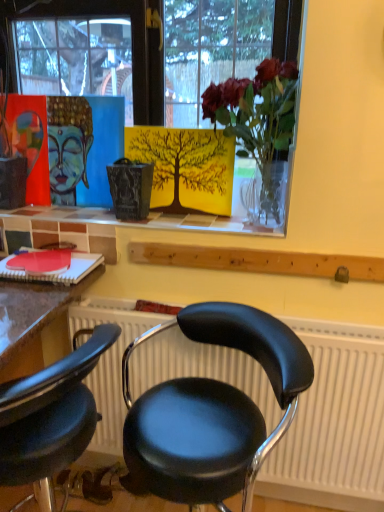
Question: Is black leather chair at lower left, marked as the 2th chair in a right-to-left arrangement, taller or shorter than translucent glass vase at upper center?

Choices:
 (A) short
 (B) tall

Answer: (B)

Question: From the image's perspective, is black leather chair at lower left, which is counted as the 1th chair, starting from the left, located above or below translucent glass vase at upper center?

Choices:
 (A) below
 (B) above

Answer: (A)

Question: Estimate the real-world distances between objects in this image. Which object is closer to the black leather chair at center, which is the first chair from right to left?

Choices:
 (A) matte acrylic painting of buddha head at upper left
 (B) black leather chair at lower left, marked as the 2th chair in a right-to-left arrangement
 (C) matte glass vase at upper center
 (D) translucent glass vase at upper center

Answer: (B)

Question: Which object is the farthest from the translucent glass vase at upper center?

Choices:
 (A) black leather chair at lower left, which is counted as the 1th chair, starting from the left
 (B) matte acrylic painting of buddha head at upper left
 (C) black leather chair at center, which is the first chair from right to left
 (D) matte glass vase at upper center

Answer: (A)